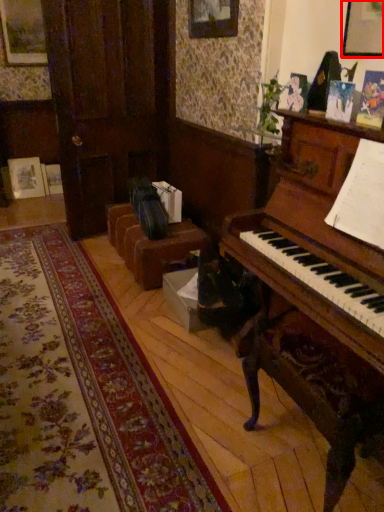
Question: From the image's perspective, where is picture frame (annotated by the red box) located in relation to furniture in the image?

Choices:
 (A) below
 (B) above

Answer: (B)